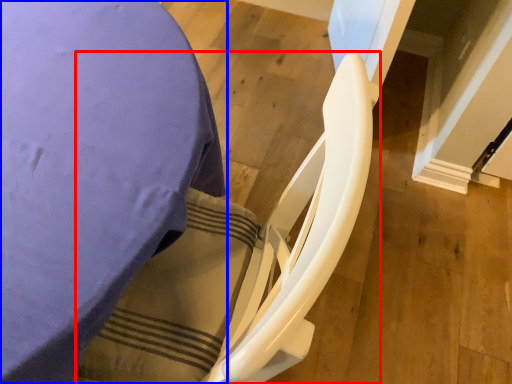
Question: Which point is closer to the camera, rocking chair (highlighted by a red box) or furniture (highlighted by a blue box)?

Choices:
 (A) rocking chair
 (B) furniture

Answer: (A)